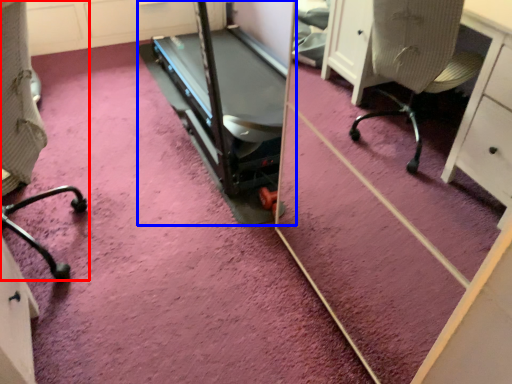
Question: Which object appears farthest to the camera in this image, furniture (highlighted by a red box) or treadmill (highlighted by a blue box)?

Choices:
 (A) furniture
 (B) treadmill

Answer: (B)